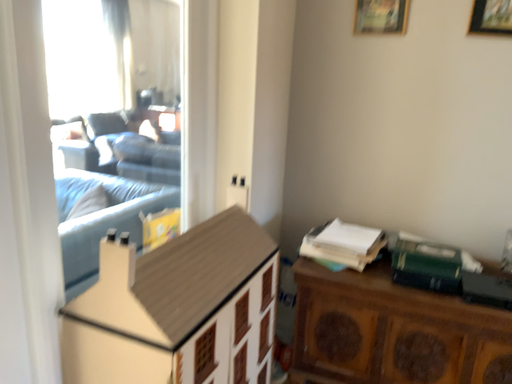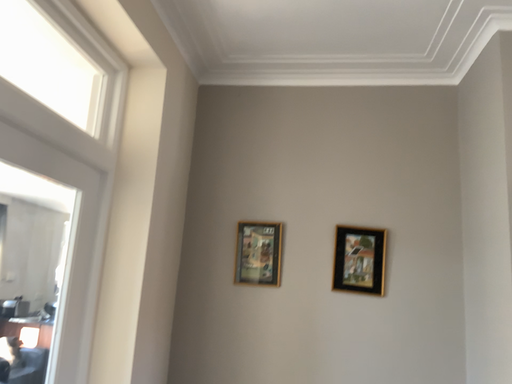
Question: Which way did the camera rotate in the video?

Choices:
 (A) rotated right
 (B) rotated left

Answer: (A)